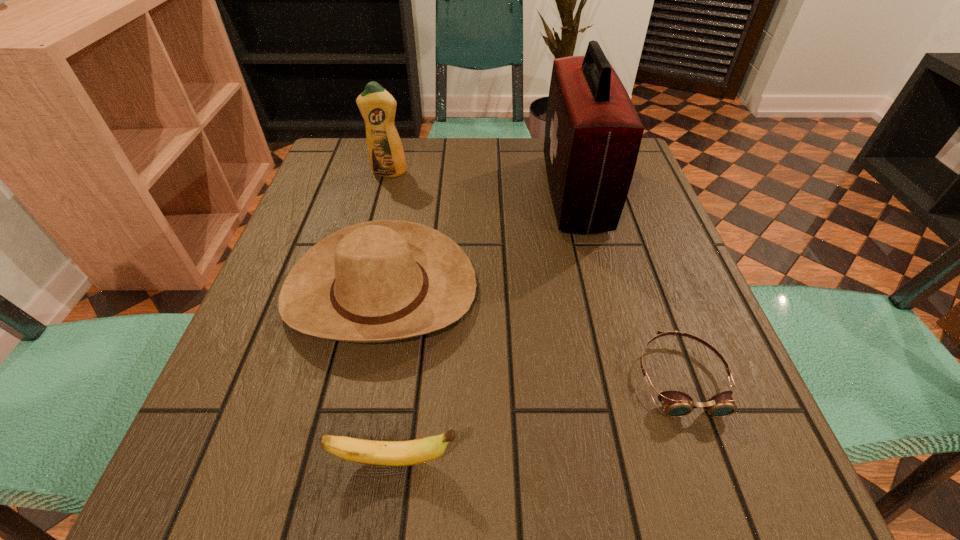
You are a GUI agent. You are given a task and a screenshot of the screen. Output one action in this format:
    pyautogui.click(x=<x>, y=<y>)
    Task: Click on the object at the far left corner
    The height and width of the screenshot is (540, 960).
    Given the screenshot: What is the action you would take?
    pyautogui.click(x=377, y=106)

Where is `object positioned at the far right corner`? The width and height of the screenshot is (960, 540). object positioned at the far right corner is located at coordinates (593, 133).

The image size is (960, 540). In the image, there is a desktop. Find the location of `vacant space at the far edge`. vacant space at the far edge is located at coordinates (531, 159).

The image size is (960, 540). I want to click on vacant region at the near edge, so click(499, 465).

This screenshot has height=540, width=960. In order to click on free location at the left edge in this screenshot , I will do `click(318, 372)`.

At what (x,y) coordinates should I click in order to perform the action: click on free region at the right edge of the desktop. Please return your answer as a coordinate pair (x, y). This screenshot has height=540, width=960. Looking at the image, I should click on (x=648, y=263).

In the image, there is a desktop. At what (x,y) coordinates should I click in order to perform the action: click on vacant space at the far left corner. Please return your answer as a coordinate pair (x, y). Looking at the image, I should click on (327, 148).

The height and width of the screenshot is (540, 960). I want to click on free space at the near right corner, so click(725, 470).

The width and height of the screenshot is (960, 540). In order to click on free point between the third shortest object and the banana in this screenshot , I will do `click(388, 376)`.

At what (x,y) coordinates should I click in order to perform the action: click on free point between the fourth shortest object and the goggles. Please return your answer as a coordinate pair (x, y). Looking at the image, I should click on (535, 275).